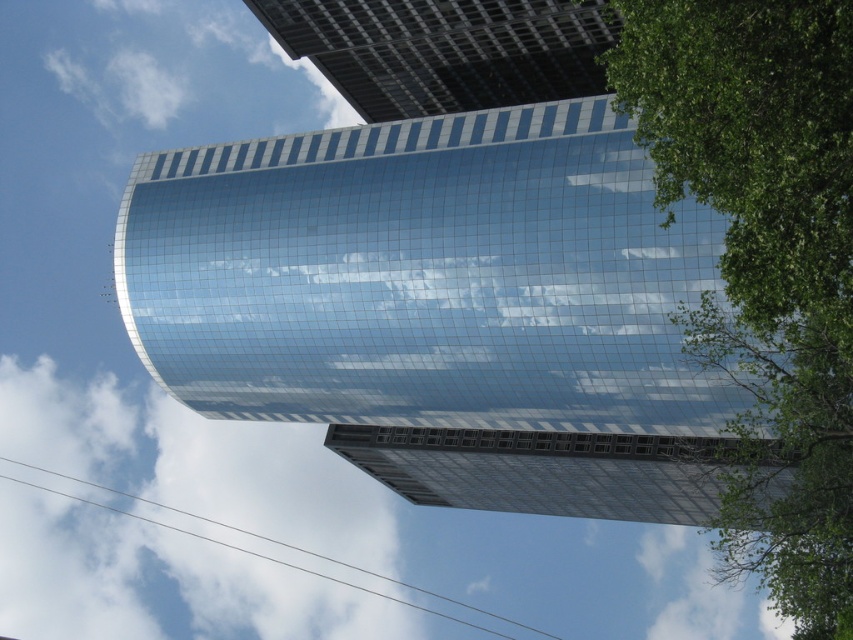
Measure the distance from glossy glass tower at center to green leafy tree at right.

The distance of glossy glass tower at center from green leafy tree at right is 71.73 feet.

Can you confirm if glossy glass tower at center is wider than green leafy tree at right?

In fact, glossy glass tower at center might be narrower than green leafy tree at right.

Does point (666, 358) come behind point (820, 339)?

Yes.

The image size is (853, 640). In order to click on glossy glass tower at center in this screenshot , I will do `click(442, 307)`.

From the picture: Between glossy glass tower at center and white fluffy cloud at upper left, which one has less height?

With less height is glossy glass tower at center.

Who is more distant from viewer, (640, 188) or (62, 625)?

The point (62, 625) is more distant.

Between point (311, 259) and point (120, 572), which one is positioned behind?

Positioned behind is point (120, 572).

Where is `glossy glass tower at center`? glossy glass tower at center is located at coordinates (442, 307).

Measure the distance between point (844, 532) and camera.

The distance of point (844, 532) from camera is 46.31 meters.

Can you confirm if green leafy tree at right is positioned to the right of white fluffy cloud at upper left?

Yes, green leafy tree at right is to the right of white fluffy cloud at upper left.

This screenshot has height=640, width=853. Identify the location of green leafy tree at right. (764, 262).